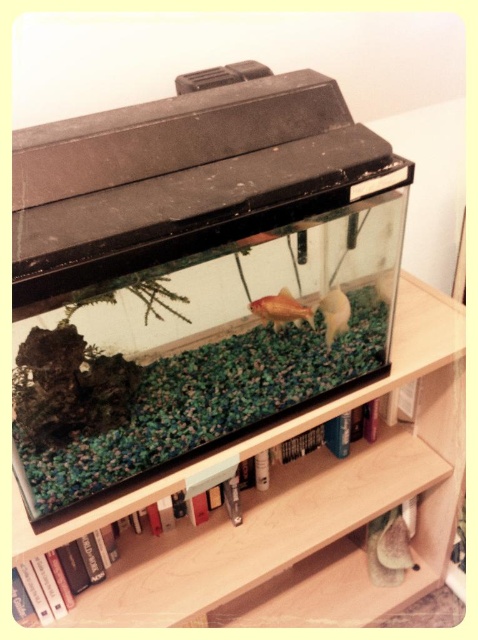
Where is the translucent glass bookshelf at center located in the image?

The translucent glass bookshelf at center is located at point (299,506) in the image.

You are standing in front of the aquarium and want to reach the point at coordinates (392, 465) on the aquarium. If your arm can extend 1 meter, can you touch that point?

The distance between you and the point at coordinates (392, 465) is 1.23 meters. Since your arm can only extend 1 meter, you cannot reach the point.